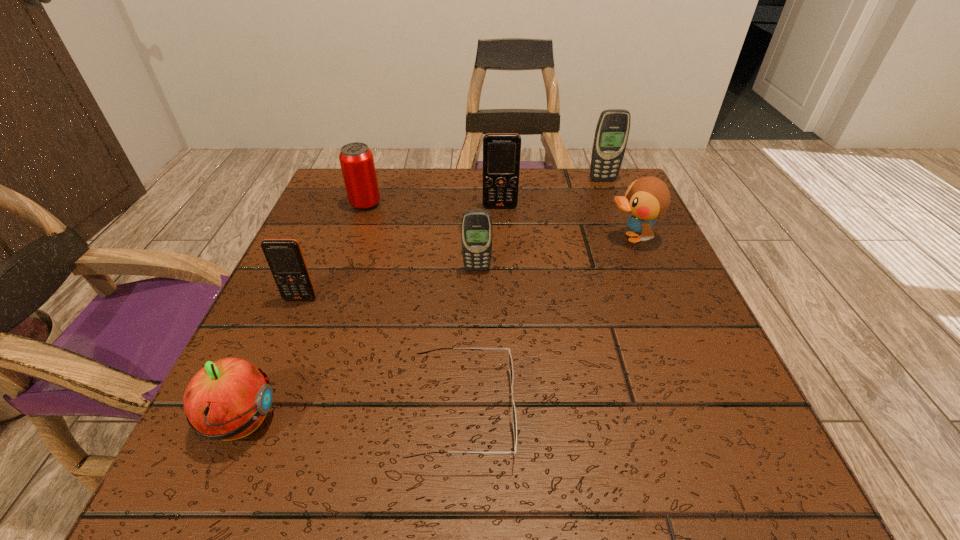
In order to click on the farther gray cellular telephone in this screenshot , I will do `click(612, 131)`.

Locate an element on the screen. The image size is (960, 540). the bigger gray cellular telephone is located at coordinates (612, 131).

Locate an element on the screen. the right orange cellular telephone is located at coordinates (501, 151).

Locate an element on the screen. The height and width of the screenshot is (540, 960). the farther orange cellular telephone is located at coordinates (501, 151).

Locate an element on the screen. This screenshot has height=540, width=960. can is located at coordinates (356, 159).

Identify the location of the fourth farthest object. (647, 198).

At what (x,y) coordinates should I click in order to perform the action: click on duck. Please return your answer as a coordinate pair (x, y). Looking at the image, I should click on (647, 198).

You are a GUI agent. You are given a task and a screenshot of the screen. Output one action in this format:
    pyautogui.click(x=<x>, y=<y>)
    Task: Click on the smaller orange cellular telephone
    The height and width of the screenshot is (540, 960).
    Given the screenshot: What is the action you would take?
    pyautogui.click(x=285, y=258)

What are the coordinates of `the left orange cellular telephone` in the screenshot? It's located at (285, 258).

Image resolution: width=960 pixels, height=540 pixels. Find the location of `the left gray cellular telephone`. the left gray cellular telephone is located at coordinates (476, 228).